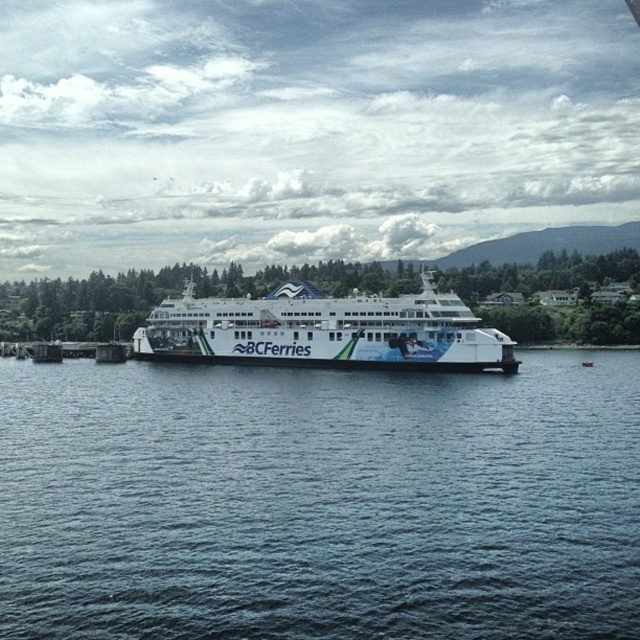
You are standing at the point marked at coordinate (374,362) on the ferry. The ferry is 252.08 feet long. If you walk straight towards the bow, will you reach the bow before the stern?

The ferry is 252.08 feet long. Since you are standing at the point marked at coordinate (374,362), walking straight towards the bow would mean you are moving towards the front of the ferry. The distance from your position to the bow is less than half the length of the ferry, so you will reach the bow before the stern.

You are a delivery drone with a maximum flight range of 25 meters. You need to deliver a package from the brown wooden dock at lower left to the white glossy ferry at center. Can you complete the delivery without needing to recharge?

The white glossy ferry at center is 23.72 meters away from the brown wooden dock at lower left. Since the distance is within your 25 meters maximum flight range, you can complete the delivery without needing to recharge.

You are standing on the brown wooden dock at lower left and want to board the ferry. Which direction should you walk to reach the blue water at center?

You should walk to the right side of the brown wooden dock at lower left because the blue water at center is positioned on the right side of it.